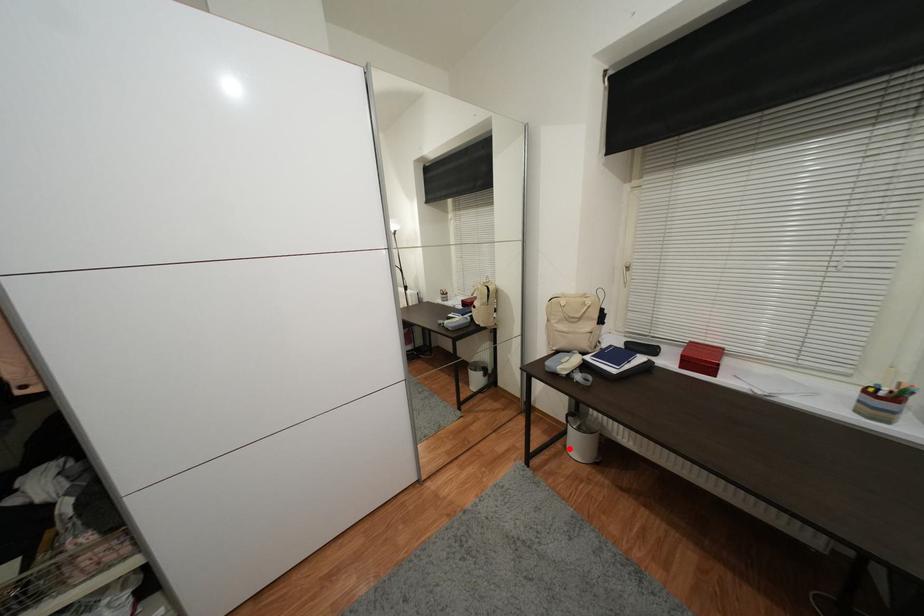
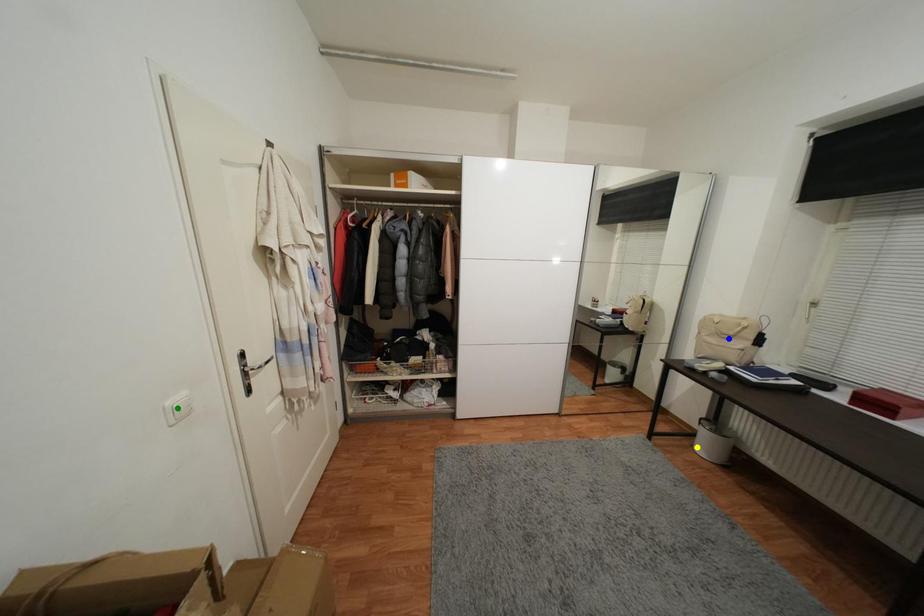
Question: I am providing you with two images of the same scene from different viewpoints. A red point is marked on the first image. You are given multiple points on the second image. Which point in image 2 represents the same 3d spot as the red point in image 1?

Choices:
 (A) yellow point
 (B) green point
 (C) blue point

Answer: (A)